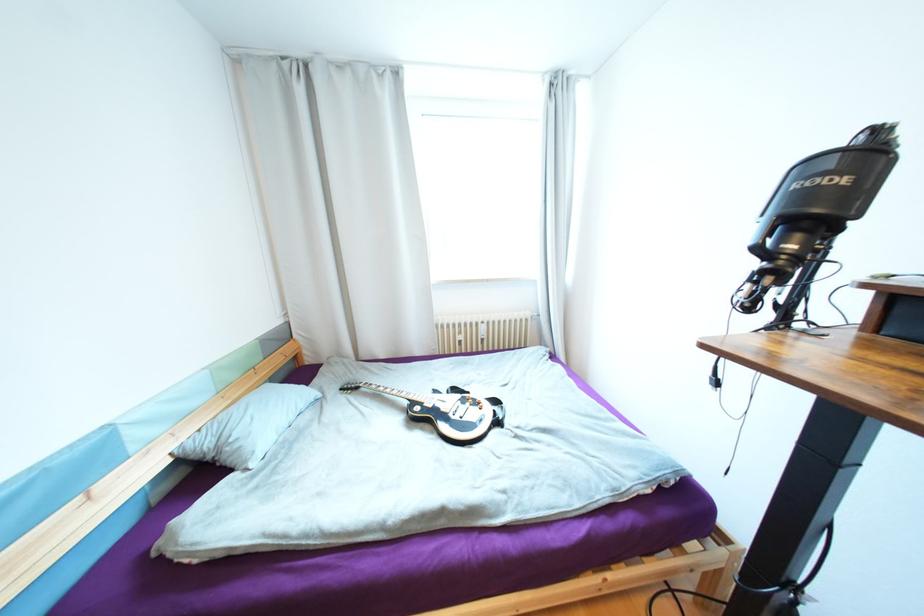
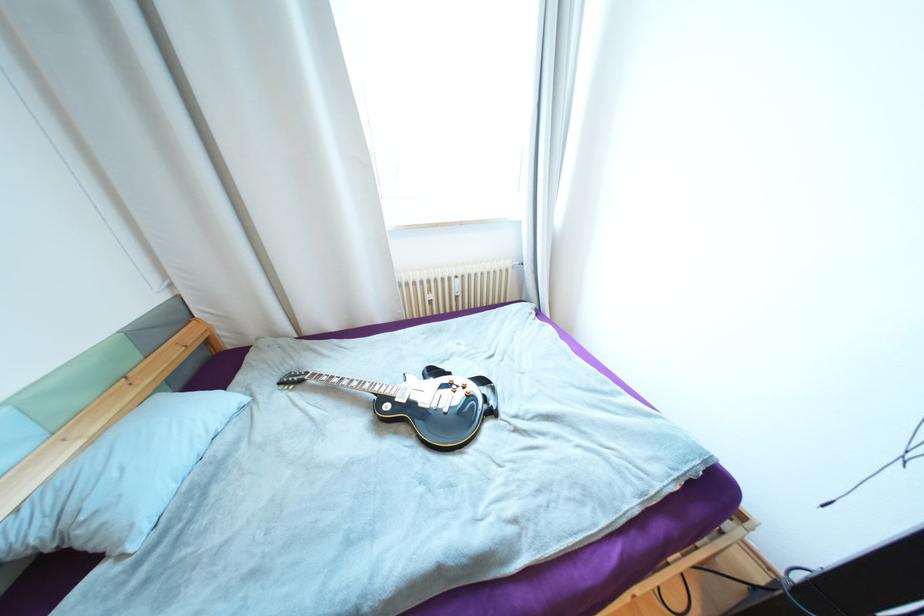
Locate, in the second image, the point that corresponds to pixel 420 399 in the first image.

(387, 391)